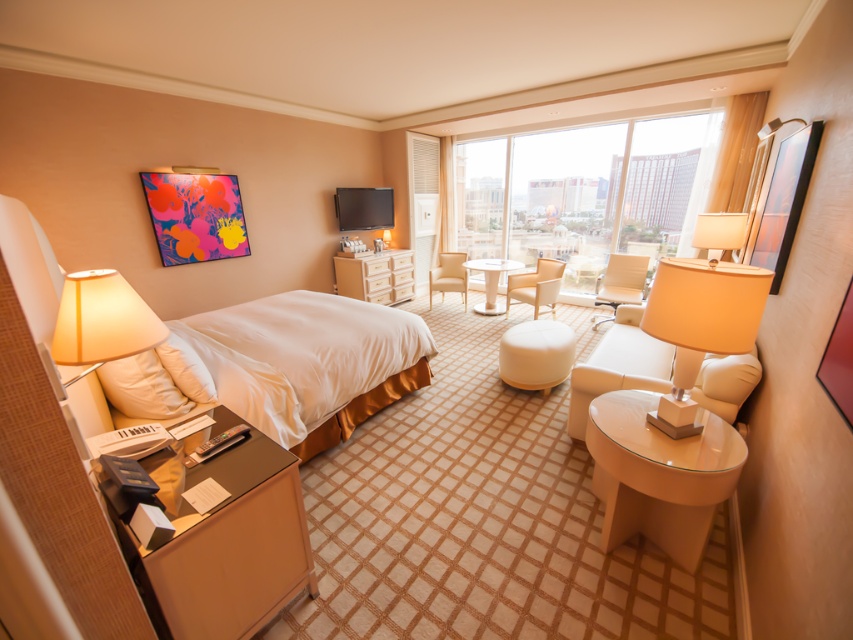
Question: Can you confirm if white fabric stool at center is wider than white fabric lampshade at upper right?

Choices:
 (A) yes
 (B) no

Answer: (A)

Question: Is white satin bed at center to the left of white glossy table at center from the viewer's perspective?

Choices:
 (A) no
 (B) yes

Answer: (B)

Question: Which point is closer to the camera?

Choices:
 (A) white fabric lampshade at upper right
 (B) matte beige lamp at right

Answer: (B)

Question: Which object is closer to the camera taking this photo?

Choices:
 (A) white fabric stool at center
 (B) white glossy table at center

Answer: (A)

Question: Is transparent glass window at center below beige fabric armchair at center?

Choices:
 (A) no
 (B) yes

Answer: (A)

Question: Considering the real-world distances, which object is farthest from the white soft pillow at left?

Choices:
 (A) beige fabric pillow at left
 (B) white fabric stool at center
 (C) white fabric lampshade at upper right
 (D) transparent glass window at center

Answer: (D)